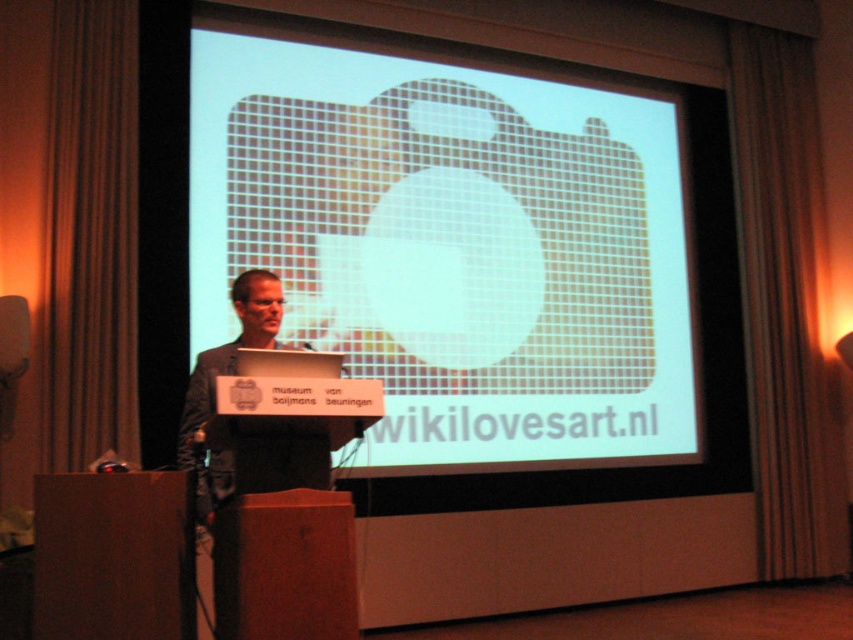
Based on the photo, is white mesh screen at center wider than dark gray suit at center?

Correct, the width of white mesh screen at center exceeds that of dark gray suit at center.

Which is in front, point (280, 209) or point (207, 388)?

Point (207, 388)

Identify the location of white mesh screen at center. (453, 243).

Who is taller, white mesh screen at center or matte black laptop at center?

Standing taller between the two is white mesh screen at center.

Does white mesh screen at center appear under matte black laptop at center?

No, white mesh screen at center is not below matte black laptop at center.

Is point (637, 97) less distant than point (286, 355)?

No, (637, 97) is behind (286, 355).

You are a GUI agent. You are given a task and a screenshot of the screen. Output one action in this format:
    pyautogui.click(x=<x>, y=<y>)
    Task: Click on the white mesh screen at center
    The image size is (853, 640).
    Given the screenshot: What is the action you would take?
    pyautogui.click(x=453, y=243)

Between dark gray suit at center and matte black laptop at center, which one has more height?

dark gray suit at center is taller.

Is dark gray suit at center taller than matte black laptop at center?

Indeed, dark gray suit at center has a greater height compared to matte black laptop at center.

Who is more distant from viewer, [207,348] or [260,358]?

The point [207,348] is more distant.

Identify the location of dark gray suit at center. (213, 387).